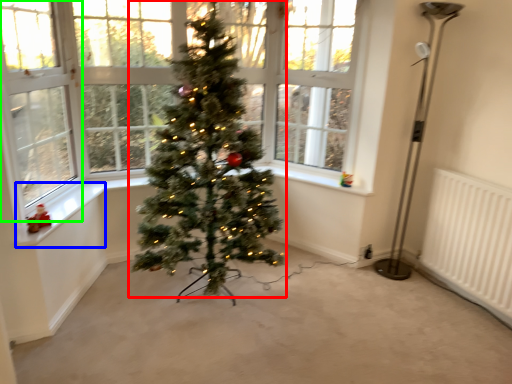
Question: Which object is positioned closest to christmas tree (highlighted by a red box)? Select from window sill (highlighted by a blue box) and window screen (highlighted by a green box).

Choices:
 (A) window sill
 (B) window screen

Answer: (A)